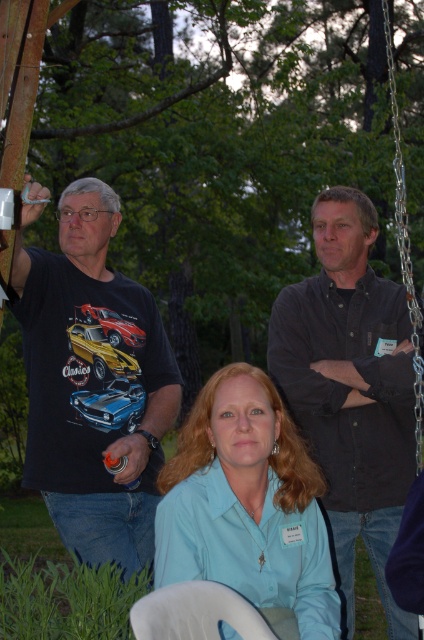
Question: Which point is farther from the camera taking this photo?

Choices:
 (A) click(x=306, y=300)
 (B) click(x=273, y=474)
 (C) click(x=39, y=436)

Answer: (A)

Question: Which object is the closest to the black cotton t-shirt at left?

Choices:
 (A) dark gray shirt at upper right
 (B) light blue shirt at center

Answer: (B)

Question: Is black cotton t-shirt at left to the right of light blue shirt at center from the viewer's perspective?

Choices:
 (A) no
 (B) yes

Answer: (A)

Question: Is black cotton t-shirt at left to the right of dark gray shirt at upper right from the viewer's perspective?

Choices:
 (A) yes
 (B) no

Answer: (B)

Question: Which point appears closest to the camera in this image?

Choices:
 (A) (142, 540)
 (B) (334, 228)
 (C) (257, 545)

Answer: (C)

Question: Does dark gray shirt at upper right have a smaller size compared to light blue shirt at center?

Choices:
 (A) no
 (B) yes

Answer: (A)